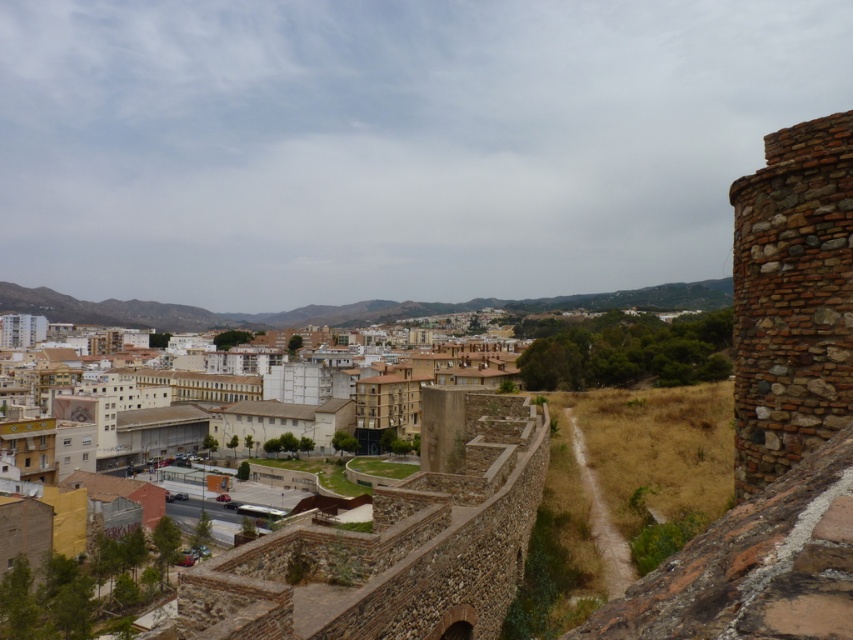
Is white concrete buildings at center to the left of brown stone tower at right from the viewer's perspective?

Indeed, white concrete buildings at center is positioned on the left side of brown stone tower at right.

Between white concrete buildings at center and brown stone tower at right, which one has more height?

Standing taller between the two is brown stone tower at right.

Which is in front, point (312, 524) or point (775, 349)?

Point (775, 349) is in front.

At what (x,y) coordinates should I click in order to perform the action: click on white concrete buildings at center. Please return your answer as a coordinate pair (x, y). Looking at the image, I should click on (395, 544).